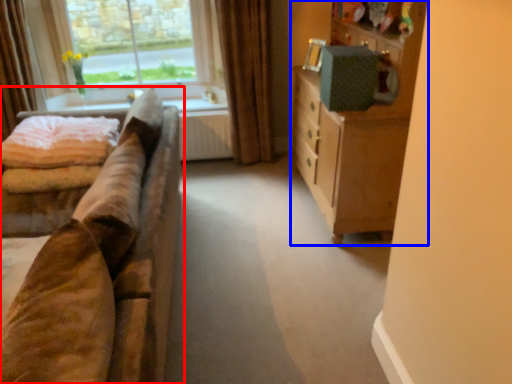
Question: Among these objects, which one is nearest to the camera, studio couch (highlighted by a red box) or cabinetry (highlighted by a blue box)?

Choices:
 (A) studio couch
 (B) cabinetry

Answer: (A)